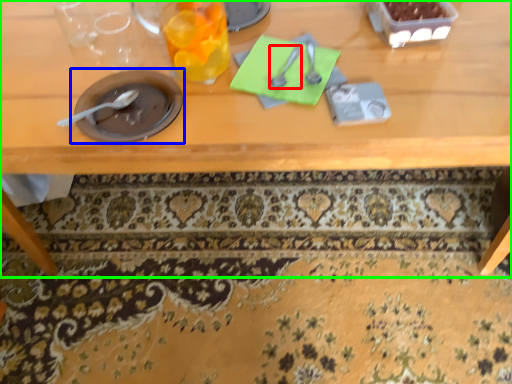
Question: Based on their relative distances, which object is farther from tableware (highlighted by a red box)? Choose from tableware (highlighted by a blue box) and table (highlighted by a green box).

Choices:
 (A) tableware
 (B) table

Answer: (B)